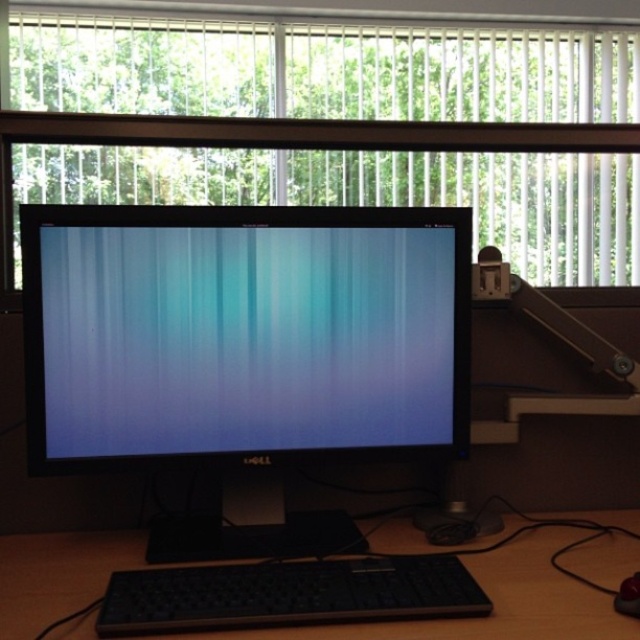
Is wooden table at lower center shorter than black plastic mouse at lower right?

Indeed, wooden table at lower center has a lesser height compared to black plastic mouse at lower right.

Is wooden table at lower center closer to camera compared to black plastic mouse at lower right?

Yes.

This screenshot has width=640, height=640. I want to click on wooden table at lower center, so click(492, 602).

This screenshot has height=640, width=640. What do you see at coordinates (320, 72) in the screenshot? I see `transparent plastic window at upper center` at bounding box center [320, 72].

Is transparent plastic window at upper center thinner than black plastic mouse at lower right?

In fact, transparent plastic window at upper center might be wider than black plastic mouse at lower right.

Is point (67, 108) behind point (616, 604)?

Yes, point (67, 108) is farther from viewer.

Where is `transparent plastic window at upper center`? transparent plastic window at upper center is located at coordinates (320, 72).

Who is lower down, matte black monitor at center or transparent plastic window at upper center?

matte black monitor at center is below.

Is matte black monitor at center closer to camera compared to transparent plastic window at upper center?

Yes.

The height and width of the screenshot is (640, 640). Find the location of `matte black monitor at center`. matte black monitor at center is located at coordinates (243, 332).